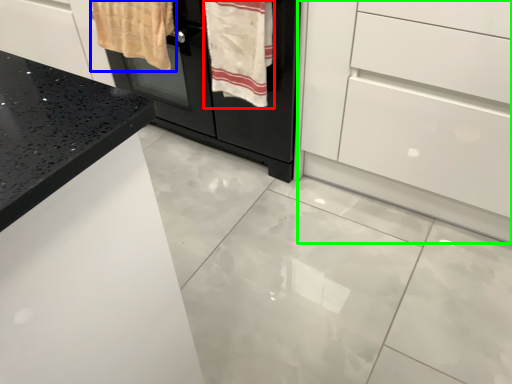
Question: Considering the real-world distances, which object is farthest from bath towel (highlighted by a red box)? bath towel (highlighted by a blue box) or chest of drawers (highlighted by a green box)?

Choices:
 (A) bath towel
 (B) chest of drawers

Answer: (B)